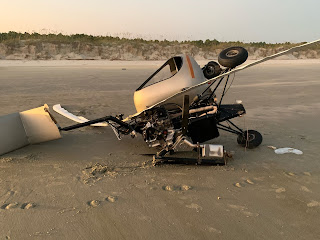
At what (x,y) coordinates should I click in order to perform the action: click on window. Please return your answer as a coordinate pair (x, y). Looking at the image, I should click on (162, 74).